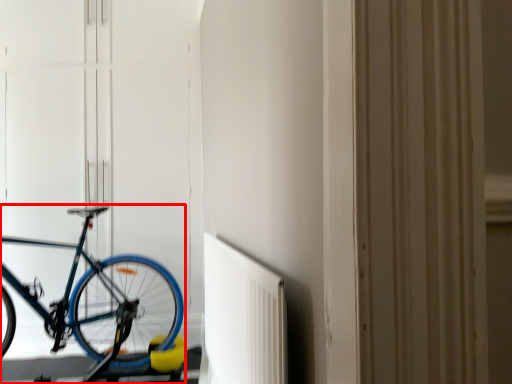
Question: From the image, what is the correct spatial relationship of bicycle (annotated by the red box) in relation to radiator?

Choices:
 (A) left
 (B) right

Answer: (A)